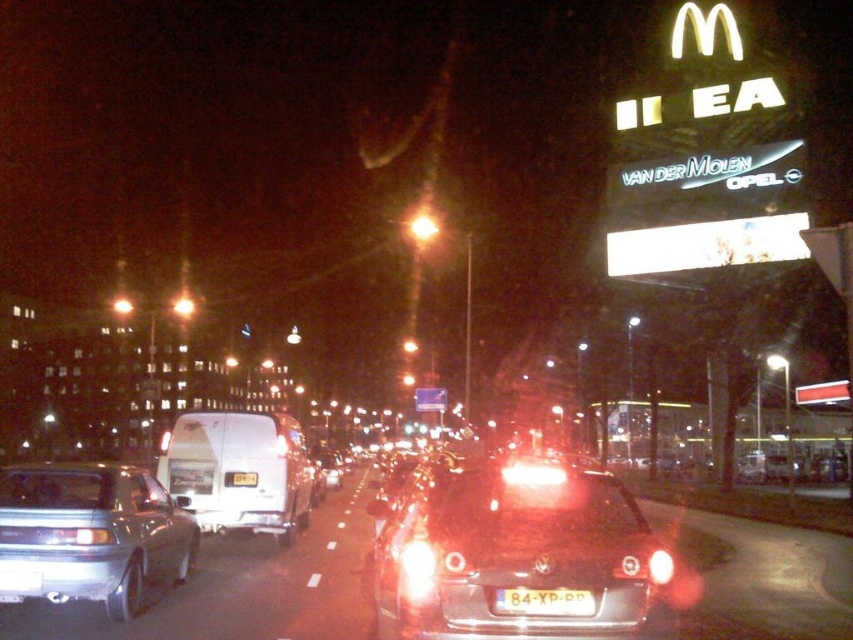
You are a driver approaching the intersection and need to determine the spacing between the matte red headlight at center and the yellow matte license plate at center on the car ahead. If the license plate is wider, would there be enough space between them to fit a standard smartphone?

The matte red headlight at center has a lesser width compared to the yellow matte license plate at center. Since the license plate is wider, the space between them may vary depending on their positioning. However, standard smartphones typically measure around 7 cm in width. Without exact distance measurements between the two objects, it is uncertain if there is sufficient space.

You are driving a car and need to stop at a specific point marked as point [473,529]. If your car requires 4.5 meters to come to a complete stop, will you be able to stop before reaching that point?

The distance of point [473,529] from the camera is 5.03 meters. Since your car needs 4.5 meters to stop, you will be able to stop before reaching the point as 5.03 meters is greater than 4.5 meters.